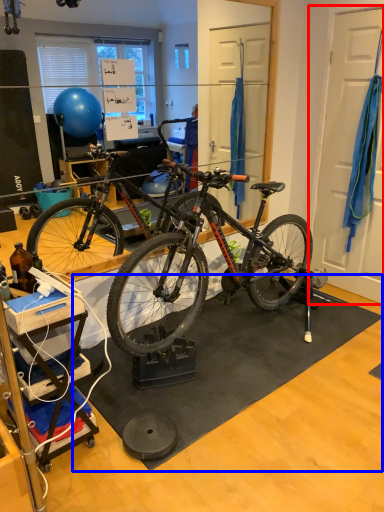
Question: Among these objects, which one is farthest to the camera, door (highlighted by a red box) or doormat (highlighted by a blue box)?

Choices:
 (A) door
 (B) doormat

Answer: (A)